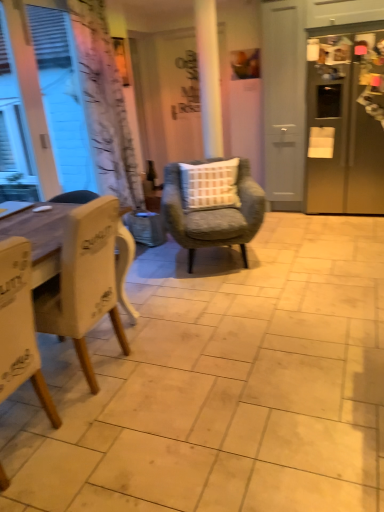
Find the location of a particular element. Image resolution: width=384 pixels, height=512 pixels. vacant area that is situated to the right of white wood chair at left, which appears as the second chair when viewed from the back is located at coordinates (174, 359).